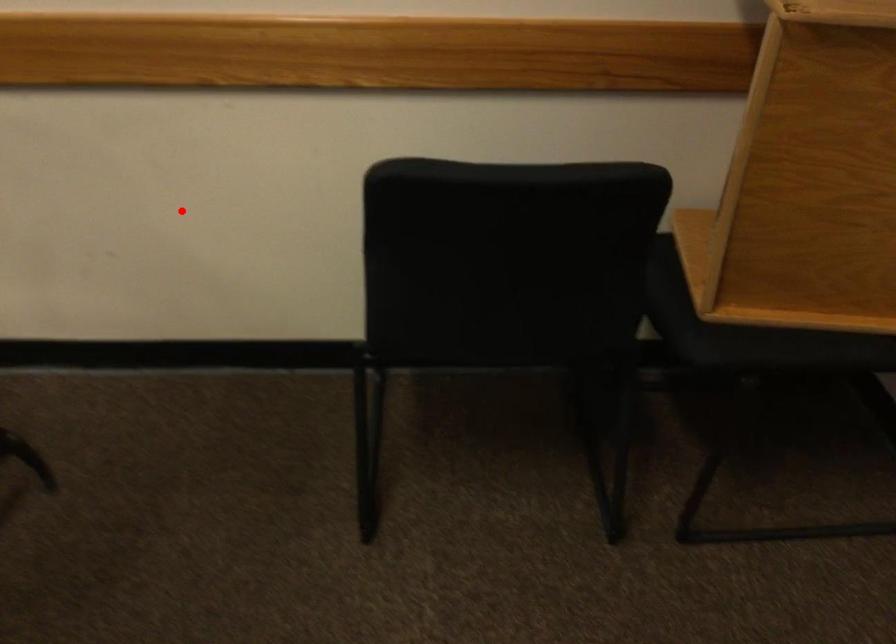
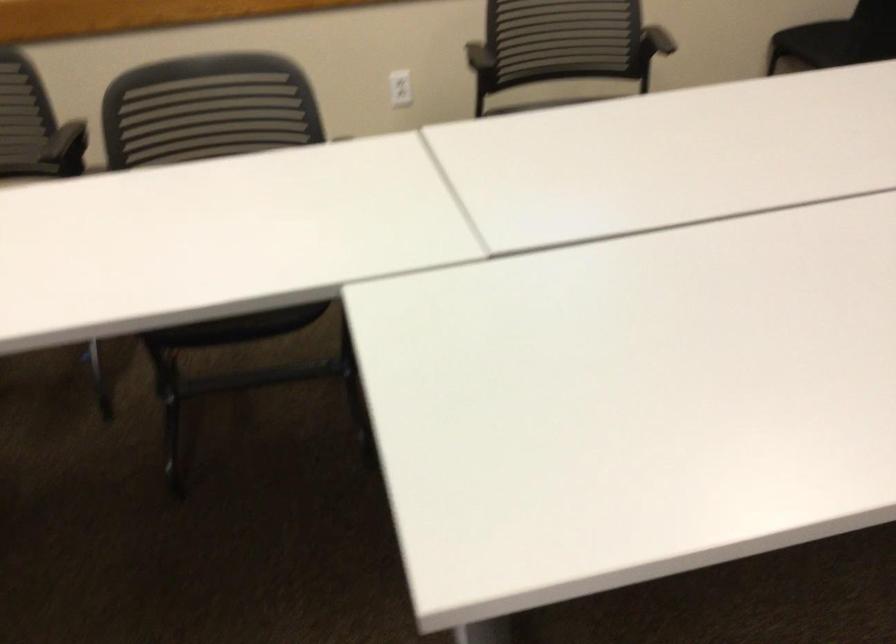
Question: I am providing you with two images of the same scene from different viewpoints. In image1, a red point is highlighted. Considering the same 3D point in image2, which of the following is correct?

Choices:
 (A) It is closer
 (B) It is farther

Answer: (B)